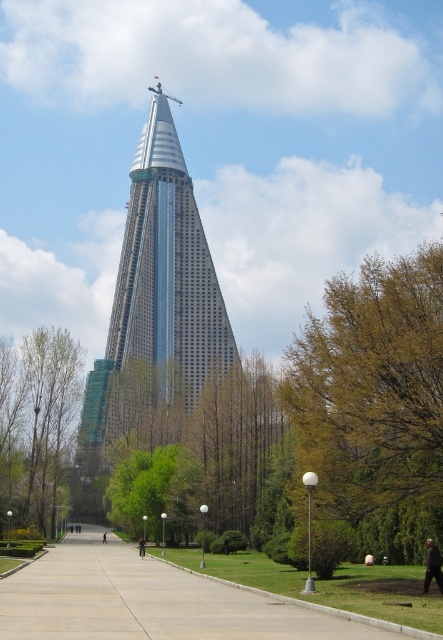
Is point (414, 420) behind point (115, 426)?

No, it is not.

Which is below, yellow-green leaves at right or silver glass tower at center?

Positioned lower is yellow-green leaves at right.

Identify the location of yellow-green leaves at right. (375, 400).

This screenshot has height=640, width=443. Identify the location of yellow-green leaves at right. point(375,400).

Is yellow-green leaves at right wider than gray concrete pavement at center?

Incorrect, yellow-green leaves at right's width does not surpass gray concrete pavement at center's.

Can you confirm if yellow-green leaves at right is shorter than gray concrete pavement at center?

In fact, yellow-green leaves at right may be taller than gray concrete pavement at center.

This screenshot has height=640, width=443. What are the coordinates of `yellow-green leaves at right` in the screenshot? It's located at (375, 400).

At what (x,y) coordinates should I click in order to perform the action: click on yellow-green leaves at right. Please return your answer as a coordinate pair (x, y). The width and height of the screenshot is (443, 640). Looking at the image, I should click on (375, 400).

Is gray concrete pavement at center shorter than dark gray jacket at lower right?

No.

Does gray concrete pavement at center appear on the left side of dark gray jacket at lower right?

Correct, you'll find gray concrete pavement at center to the left of dark gray jacket at lower right.

Locate an element on the screen. The height and width of the screenshot is (640, 443). gray concrete pavement at center is located at coordinates (148, 602).